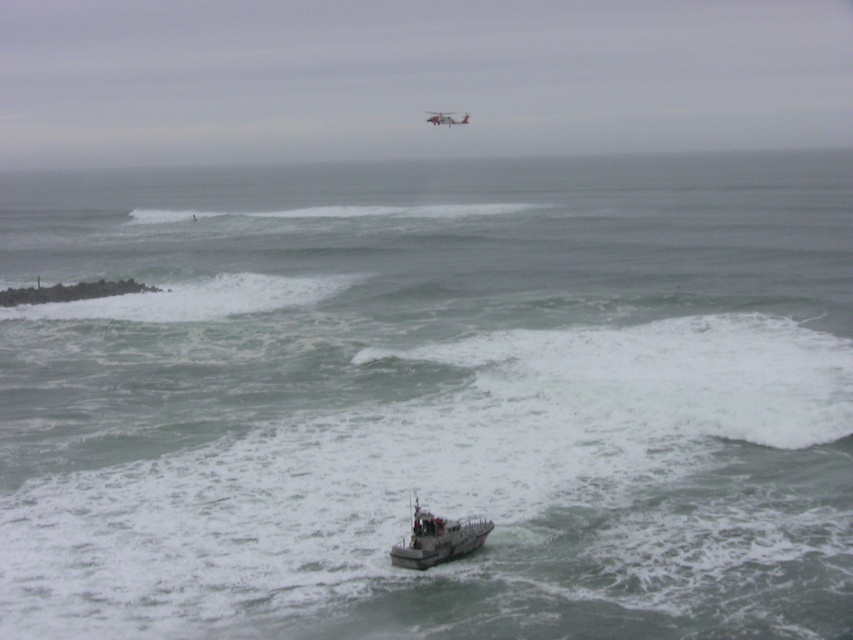
Does gray metallic boat at center appear under metallic gray helicopter at upper center?

Yes.

Who is positioned more to the right, gray metallic boat at center or metallic gray helicopter at upper center?

metallic gray helicopter at upper center is more to the right.

Does point (426, 522) lie behind point (466, 120)?

No.

This screenshot has height=640, width=853. Find the location of `gray metallic boat at center`. gray metallic boat at center is located at coordinates (437, 540).